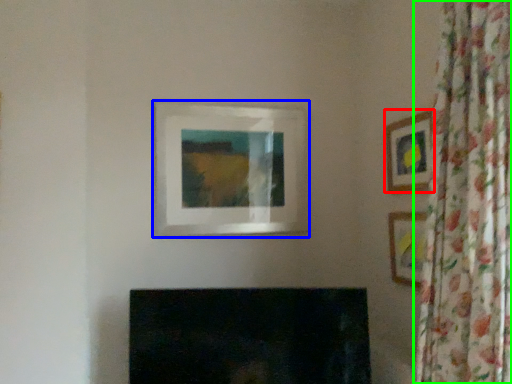
Question: Which object is the farthest from picture frame (highlighted by a red box)? Choose among these: picture frame (highlighted by a blue box) or curtain (highlighted by a green box).

Choices:
 (A) picture frame
 (B) curtain

Answer: (A)